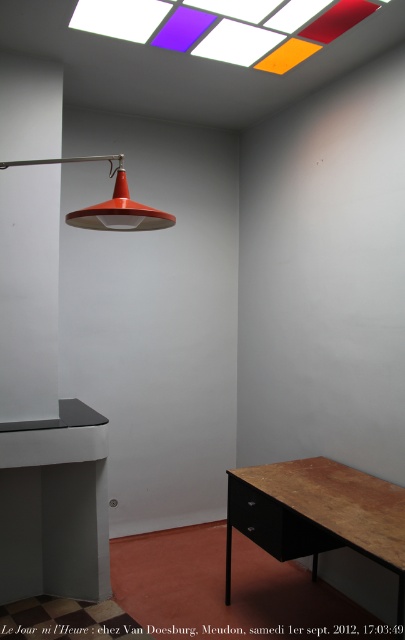
Measure the distance from translucent glass window at upper center to matte orange lampshade at upper center.

translucent glass window at upper center is 90.98 centimeters from matte orange lampshade at upper center.

Does point (191, 22) come farther from viewer compared to point (127, 211)?

Yes, point (191, 22) is behind point (127, 211).

Is point (249, 48) closer to viewer compared to point (138, 211)?

No, it is not.

The height and width of the screenshot is (640, 405). Find the location of `translucent glass window at upper center`. translucent glass window at upper center is located at coordinates (226, 26).

Is wooden desk at lower right shorter than translucent glass window at upper center?

No.

Does wooden desk at lower right lie behind translucent glass window at upper center?

No, wooden desk at lower right is closer to the viewer.

Between point (330, 481) and point (238, 4), which one is positioned behind?

Positioned behind is point (330, 481).

The image size is (405, 640). In order to click on wooden desk at lower right in this screenshot , I will do coord(317,515).

Does wooden desk at lower right appear over matte orange lampshade at upper center?

No, wooden desk at lower right is not above matte orange lampshade at upper center.

Who is more forward, [368,548] or [51,157]?

Positioned in front is point [368,548].

The height and width of the screenshot is (640, 405). What are the coordinates of `wooden desk at lower right` in the screenshot? It's located at (317, 515).